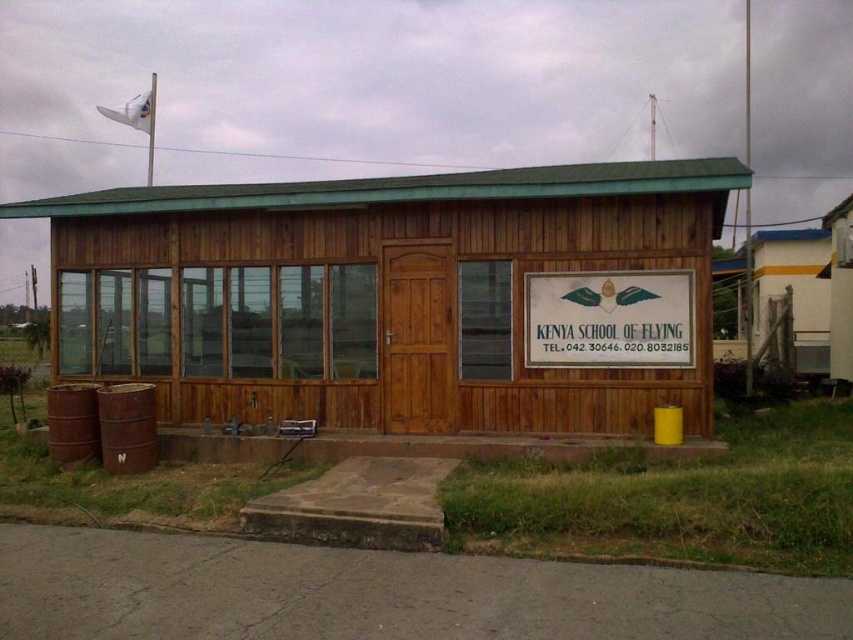
You are standing in front of the Kenya School of Flying and want to enter the building. Which object, the wooden hut at center or the white wooden sign at center, should you approach first?

You should approach the wooden hut at center first because it is closer to you than the white wooden sign at center.